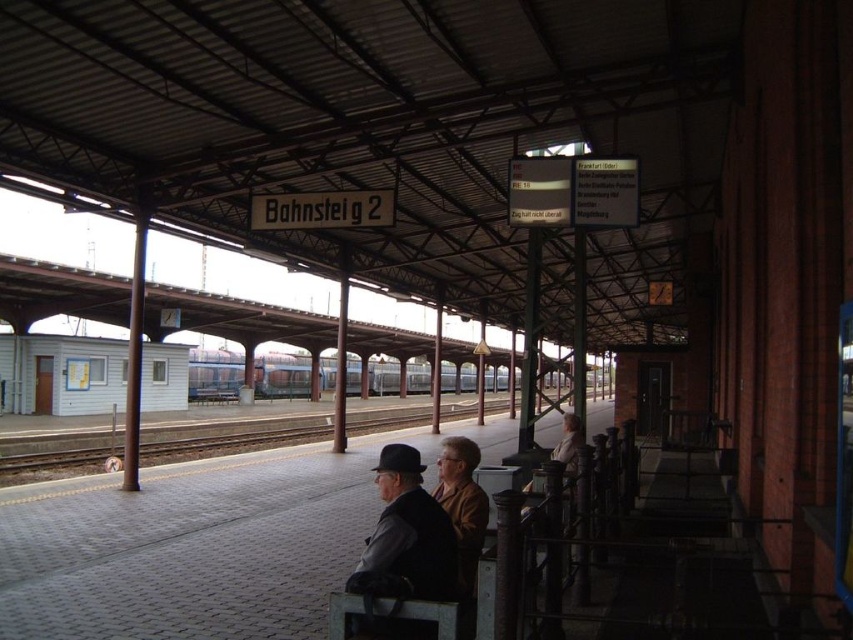
Question: Which of the following is the farthest from the observer?

Choices:
 (A) blue metallic train at center
 (B) dark gray wool hat at center

Answer: (A)

Question: Is dark gray wool hat at center positioned before blue metallic train at center?

Choices:
 (A) no
 (B) yes

Answer: (B)

Question: Is dark gray wool hat at center above blue metallic train at center?

Choices:
 (A) yes
 (B) no

Answer: (A)

Question: Does dark gray wool hat at center appear on the right side of blue metallic train at center?

Choices:
 (A) no
 (B) yes

Answer: (B)

Question: Among these objects, which one is nearest to the camera?

Choices:
 (A) dark gray wool hat at center
 (B) blue metallic train at center

Answer: (A)